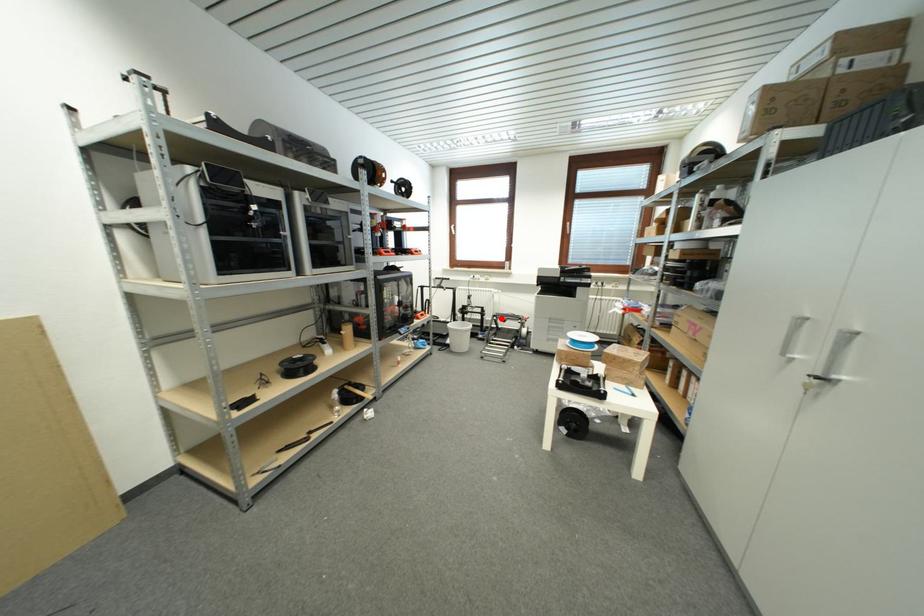
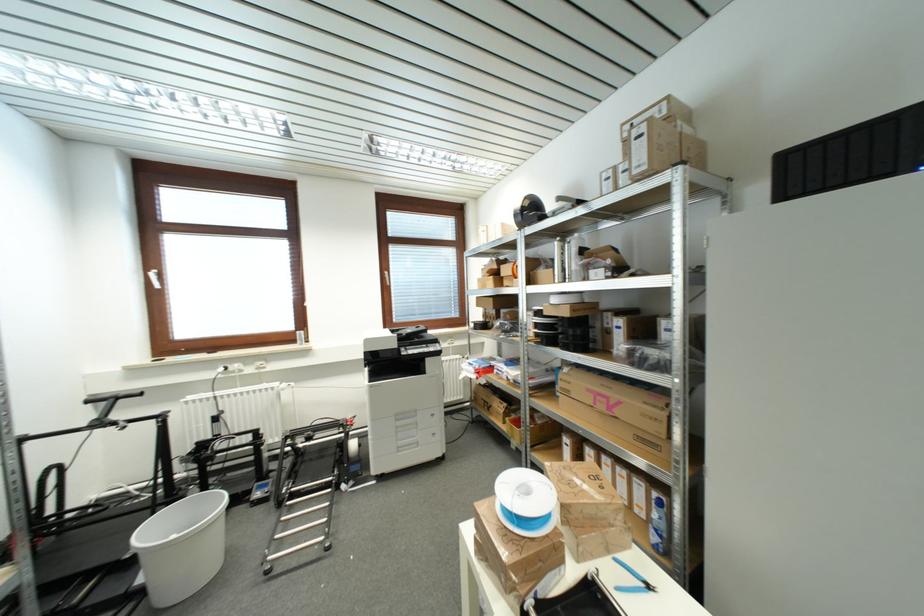
Question: I am providing you with two images of the same scene from different viewpoints. A red point is shown in image1. For the corresponding object point in image2, is it positioned nearer or farther from the camera?

Choices:
 (A) Nearer
 (B) Farther

Answer: (B)